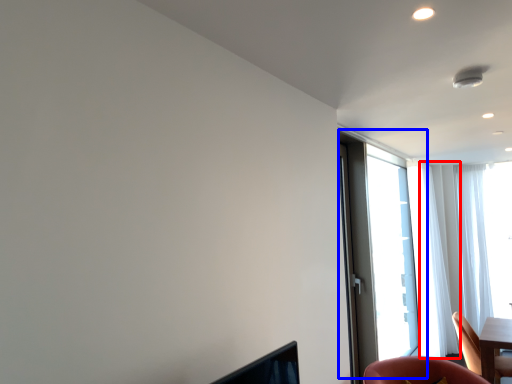
Question: Which object appears farthest to the camera in this image, curtain (highlighted by a red box) or window (highlighted by a blue box)?

Choices:
 (A) curtain
 (B) window

Answer: (A)